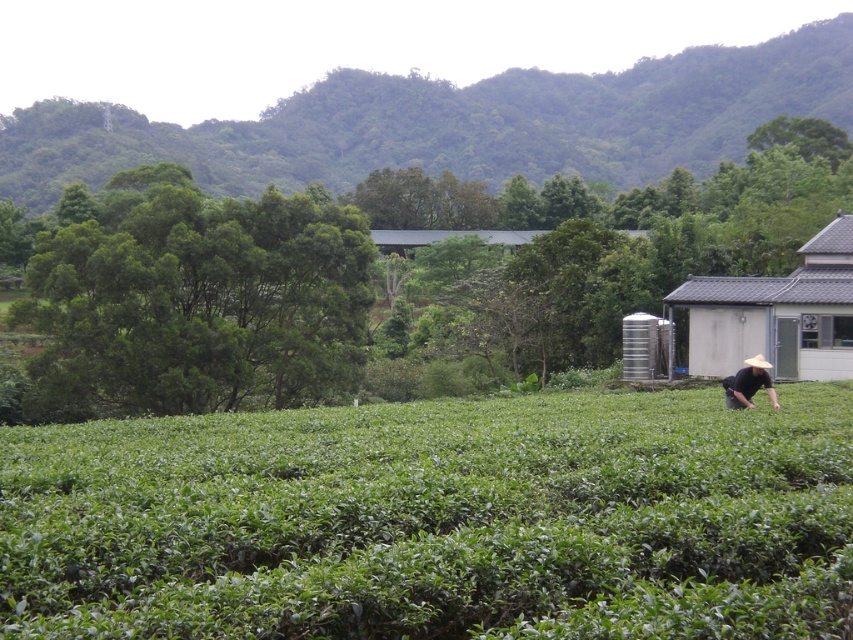
You are standing in the middle of the tea plantation and want to take a photo of the green leafy field at lower center and the white textured hut at right. Which object should you focus on first if you want both to be in sharp focus?

Result: The green leafy field at lower center is closer to the viewer than the white textured hut at right. To have both in sharp focus, focus on the white textured hut at right since it is farther away, as depth of field extends behind the point of focus.

You are standing at the center of the tea plantation and see the point marked at coordinates (776,314). What object is located at that point?

The point at coordinates (776,314) indicates a white textured hut at right.